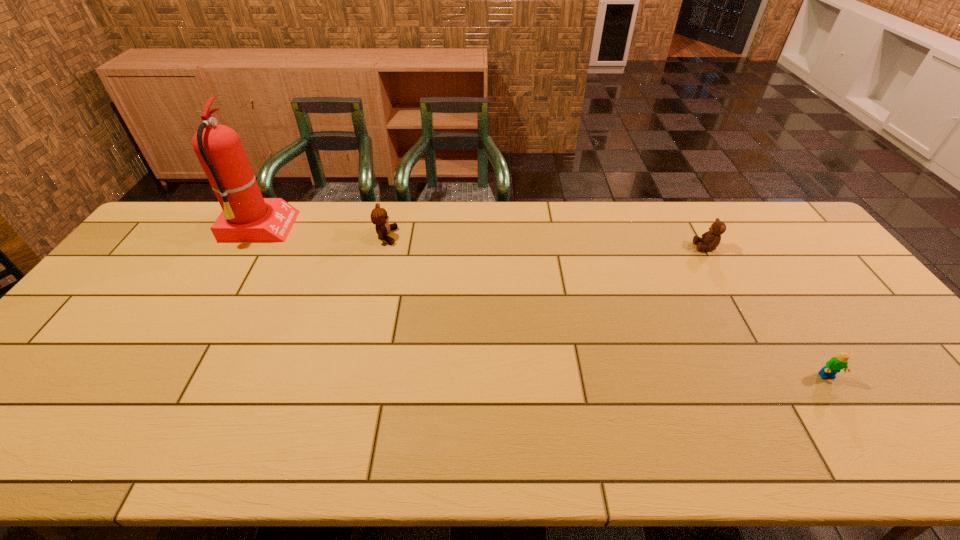
Where is `the leftmost object`? the leftmost object is located at coordinates (246, 217).

This screenshot has height=540, width=960. I want to click on fire extinguisher, so (246, 217).

Where is `the left teddy bear`? This screenshot has height=540, width=960. the left teddy bear is located at coordinates (379, 217).

You are a GUI agent. You are given a task and a screenshot of the screen. Output one action in this format:
    pyautogui.click(x=<x>, y=<y>)
    Task: Click on the right teddy bear
    The image size is (960, 540).
    Given the screenshot: What is the action you would take?
    pyautogui.click(x=711, y=239)

The image size is (960, 540). In order to click on the second object from right to left in this screenshot , I will do `click(711, 239)`.

Identify the location of Lego. (835, 364).

The image size is (960, 540). Find the location of `the nearest object`. the nearest object is located at coordinates (835, 364).

Locate an element on the screen. vacant point located on the front-facing side of the fire extinguisher is located at coordinates click(405, 228).

Where is `free spot located 0.320m on the front-facing side of the third object from right to left`? This screenshot has height=540, width=960. free spot located 0.320m on the front-facing side of the third object from right to left is located at coordinates (494, 237).

Where is `vacant space situated 0.160m on the face of the third object from left to right`? vacant space situated 0.160m on the face of the third object from left to right is located at coordinates (644, 247).